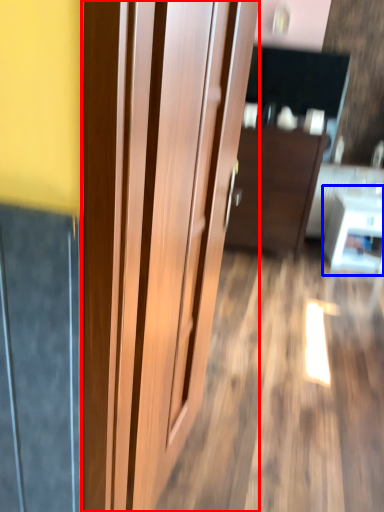
Question: Which object is further to the camera taking this photo, door (highlighted by a red box) or table (highlighted by a blue box)?

Choices:
 (A) door
 (B) table

Answer: (B)